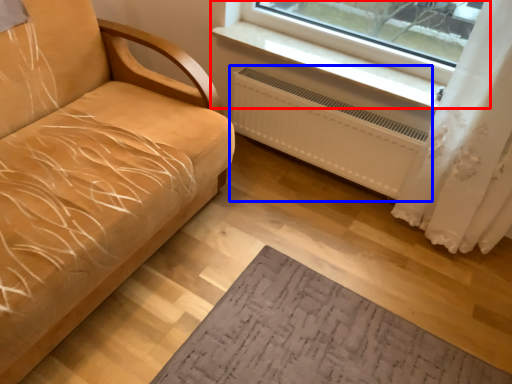
Question: Which object appears closest to the camera in this image, window (highlighted by a red box) or radiator (highlighted by a blue box)?

Choices:
 (A) window
 (B) radiator

Answer: (A)